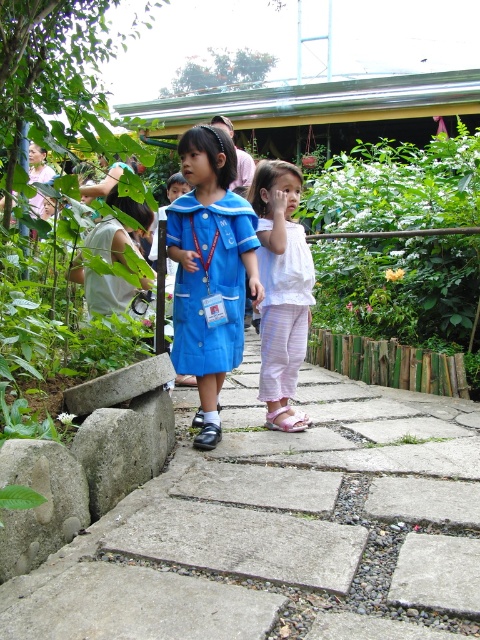
Question: Which of the following is the closest to the observer?

Choices:
 (A) matte blue dress at center
 (B) concrete paving stones at center
 (C) white striped fabric dress at center

Answer: (B)

Question: Considering the real-world distances, which object is closest to the blue fabric dress at center?

Choices:
 (A) matte blue dress at center
 (B) white striped fabric dress at center

Answer: (A)

Question: Which object is closer to the camera taking this photo?

Choices:
 (A) white striped fabric dress at center
 (B) matte blue dress at center
 (C) blue fabric dress at center
 (D) concrete paving stones at center

Answer: (D)

Question: Is concrete paving stones at center thinner than matte blue dress at center?

Choices:
 (A) no
 (B) yes

Answer: (A)

Question: Is concrete paving stones at center bigger than matte blue dress at center?

Choices:
 (A) no
 (B) yes

Answer: (B)

Question: Can you confirm if matte blue dress at center is smaller than blue fabric dress at center?

Choices:
 (A) no
 (B) yes

Answer: (A)